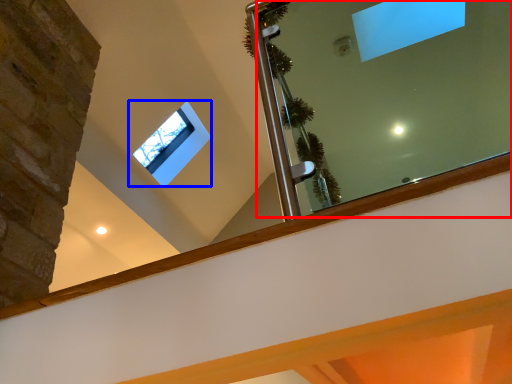
Question: Which of the following is the closest to the observer, mirror (highlighted by a red box) or window (highlighted by a blue box)?

Choices:
 (A) mirror
 (B) window

Answer: (A)